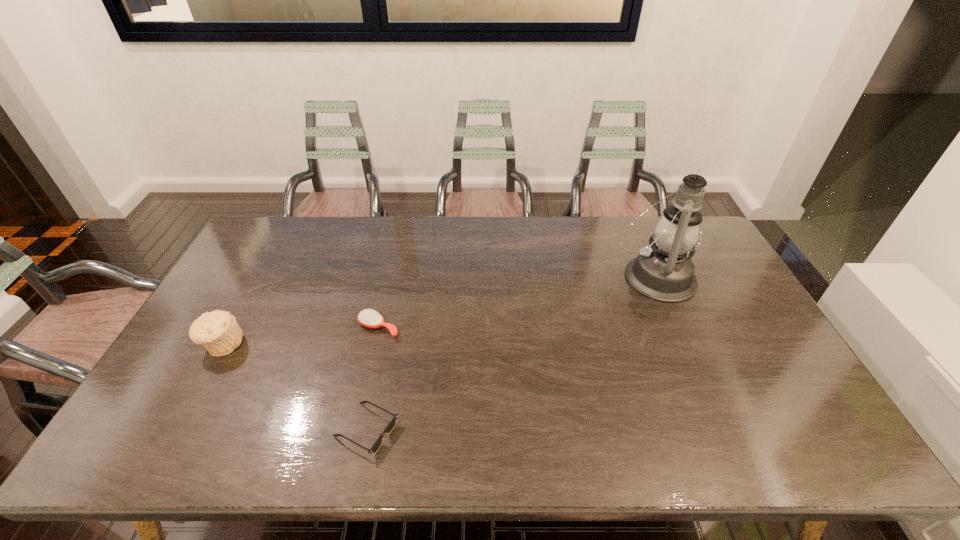
Image resolution: width=960 pixels, height=540 pixels. In order to click on vacant area at the far left corner of the desktop in this screenshot , I will do `click(280, 254)`.

Image resolution: width=960 pixels, height=540 pixels. What are the coordinates of `vacant space at the near right corner` in the screenshot? It's located at (818, 429).

Locate an element on the screen. vacant region between the hairbrush and the muffin is located at coordinates point(300,336).

This screenshot has width=960, height=540. I want to click on vacant point located between the hairbrush and the shortest object, so click(x=372, y=379).

This screenshot has width=960, height=540. Identify the location of free spot between the sunglasses and the third shortest object. (295, 387).

What are the coordinates of `unoccupied area between the hairbrush and the nearest object` in the screenshot? It's located at (372, 379).

Identify the location of free spot between the shortest object and the second shortest object. (372, 379).

Where is `free space between the hairbrush and the shortest object`? free space between the hairbrush and the shortest object is located at coordinates (372, 379).

Where is `vacant space that's between the leftmost object and the farthest object`? This screenshot has width=960, height=540. vacant space that's between the leftmost object and the farthest object is located at coordinates (439, 311).

Locate an element on the screen. Image resolution: width=960 pixels, height=540 pixels. vacant area that lies between the muffin and the sunglasses is located at coordinates (295, 387).